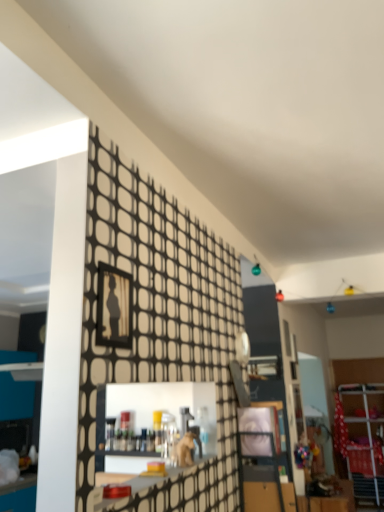
What is the approximate width of black textured wall at center?

It is 2.63 centimeters.

Where is `black textured wall at center`? black textured wall at center is located at coordinates (157, 309).

The width and height of the screenshot is (384, 512). Describe the element at coordinates (157, 309) in the screenshot. I see `black textured wall at center` at that location.

At what (x,y) coordinates should I click in order to perform the action: click on black textured wall at center. Please return your answer as a coordinate pair (x, y). This screenshot has width=384, height=512. Looking at the image, I should click on (157, 309).